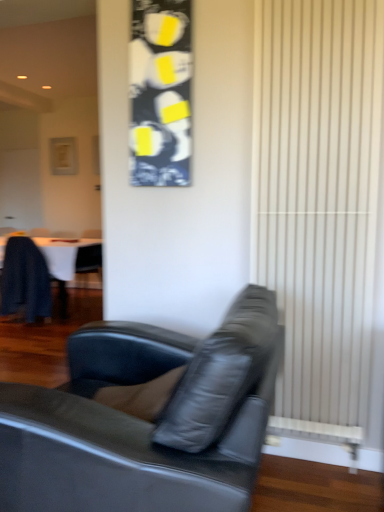
Question: Is white textured radiator at right taller than dark wood table at left?

Choices:
 (A) no
 (B) yes

Answer: (B)

Question: Is white textured radiator at right thinner than dark wood table at left?

Choices:
 (A) yes
 (B) no

Answer: (A)

Question: Is white textured radiator at right further to camera compared to dark wood table at left?

Choices:
 (A) no
 (B) yes

Answer: (A)

Question: Is white textured radiator at right directly adjacent to dark wood table at left?

Choices:
 (A) yes
 (B) no

Answer: (B)

Question: Is white textured radiator at right bigger than dark wood table at left?

Choices:
 (A) yes
 (B) no

Answer: (B)

Question: Is white textured radiator at right in front of dark wood table at left?

Choices:
 (A) yes
 (B) no

Answer: (A)

Question: Is black leather couch at center aimed at white textured radiator at right?

Choices:
 (A) no
 (B) yes

Answer: (A)

Question: Is black leather couch at center closer to camera compared to white textured radiator at right?

Choices:
 (A) yes
 (B) no

Answer: (A)

Question: Does black leather couch at center touch white textured radiator at right?

Choices:
 (A) yes
 (B) no

Answer: (B)

Question: Can you confirm if black leather couch at center is thinner than white textured radiator at right?

Choices:
 (A) no
 (B) yes

Answer: (A)

Question: Is black leather couch at center surrounding white textured radiator at right?

Choices:
 (A) yes
 (B) no

Answer: (B)

Question: Can you confirm if black leather couch at center is taller than white textured radiator at right?

Choices:
 (A) yes
 (B) no

Answer: (B)

Question: Can you see dark blue leather chair at left touching dark wood table at left?

Choices:
 (A) no
 (B) yes

Answer: (B)